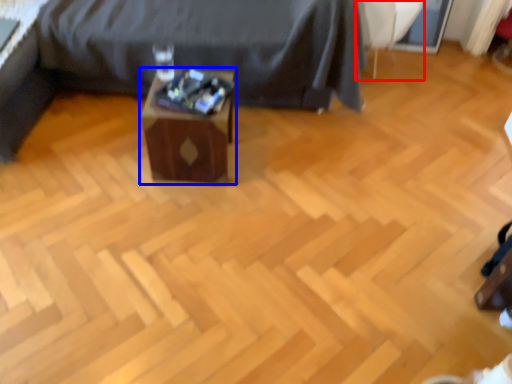
Question: Which object appears farthest to the camera in this image, swivel chair (highlighted by a red box) or table (highlighted by a blue box)?

Choices:
 (A) swivel chair
 (B) table

Answer: (A)